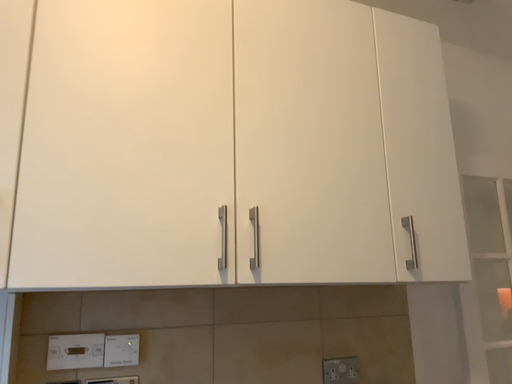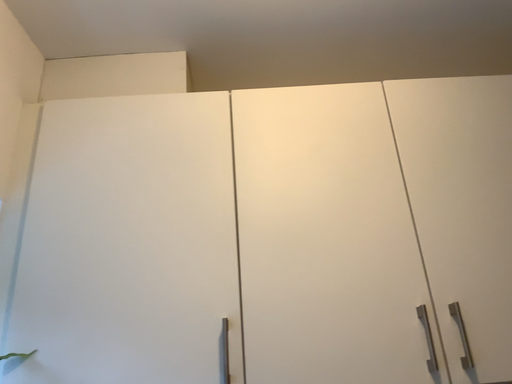
Question: Which way did the camera rotate in the video?

Choices:
 (A) rotated left
 (B) rotated right

Answer: (A)